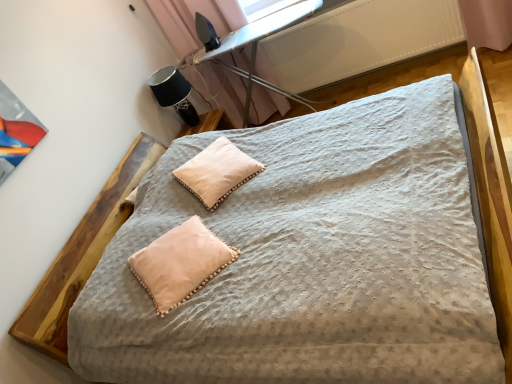
From the picture: What is the approximate width of white textured radiator at upper right?

white textured radiator at upper right is 5.88 inches wide.

In order to face white textured radiator at upper right, should I rotate leftwards or rightwards?

Rotate your view right by about 14.005°.

This screenshot has width=512, height=384. What do you see at coordinates (256, 48) in the screenshot? I see `metal ironing board at upper center` at bounding box center [256, 48].

Image resolution: width=512 pixels, height=384 pixels. Identify the location of black fabric table lamp at upper left. (174, 93).

Where is `white textured radiator at upper right`? Image resolution: width=512 pixels, height=384 pixels. white textured radiator at upper right is located at coordinates (360, 40).

Choose the correct answer: Is white textured radiator at upper right inside peach velvet pillow at lower left, which is the 2th pillow from top to bottom, or outside it?

white textured radiator at upper right lies outside peach velvet pillow at lower left, which is the 2th pillow from top to bottom.

Is point (319, 85) closer to camera compared to point (221, 264)?

No, it is not.

Does white textured radiator at upper right come in front of peach velvet pillow at lower left, marked as the first pillow in a front-to-back arrangement?

No, white textured radiator at upper right is further to the viewer.

Where is `table on the left of white textured radiator at upper right`? The width and height of the screenshot is (512, 384). table on the left of white textured radiator at upper right is located at coordinates (256, 48).

In the scene shown: Considering the sizes of metal ironing board at upper center and white textured radiator at upper right in the image, is metal ironing board at upper center bigger or smaller than white textured radiator at upper right?

metal ironing board at upper center is bigger than white textured radiator at upper right.

Considering the positions of objects metal ironing board at upper center and white textured radiator at upper right in the image provided, who is more to the right, metal ironing board at upper center or white textured radiator at upper right?

white textured radiator at upper right.

Can you see metal ironing board at upper center touching white textured radiator at upper right?

No, metal ironing board at upper center is not next to white textured radiator at upper right.

Is white textured radiator at upper right at the back of peach velvet pillow at lower left, the 2th pillow from the back?

peach velvet pillow at lower left, the 2th pillow from the back, does not have its back to white textured radiator at upper right.

Is peach velvet pillow at lower left, the 2th pillow from the back, completely or partially outside of white textured radiator at upper right?

Yes.

From a real-world perspective, between peach velvet pillow at lower left, which appears as the first pillow when ordered from the bottom, and white textured radiator at upper right, who is vertically lower?

white textured radiator at upper right, from a real-world perspective.

Is peach velvet pillow at lower left, marked as the first pillow in a front-to-back arrangement, to the left or to the right of white textured radiator at upper right in the image?

peach velvet pillow at lower left, marked as the first pillow in a front-to-back arrangement, is positioned on white textured radiator at upper right's left side.

Does peach velvet pillow at lower left, the 2th pillow from the back, contain white soft pillow at center, the second pillow positioned from the bottom?

No, white soft pillow at center, the second pillow positioned from the bottom, is not surrounded by peach velvet pillow at lower left, the 2th pillow from the back.

Can you confirm if peach velvet pillow at lower left, marked as the first pillow in a front-to-back arrangement, is smaller than white soft pillow at center, the second pillow positioned from the bottom?

Yes, peach velvet pillow at lower left, marked as the first pillow in a front-to-back arrangement, is smaller than white soft pillow at center, the second pillow positioned from the bottom.

Considering the relative positions of peach velvet pillow at lower left, the 2th pillow from the back, and white soft pillow at center, which is counted as the second pillow, starting from the front, in the image provided, is peach velvet pillow at lower left, the 2th pillow from the back, behind white soft pillow at center, which is counted as the second pillow, starting from the front,?

No, peach velvet pillow at lower left, the 2th pillow from the back, is in front of white soft pillow at center, which is counted as the second pillow, starting from the front.

Consider the image. Is the position of white textured radiator at upper right more distant than that of black fabric table lamp at upper left?

No.

Is black fabric table lamp at upper left at the back of white textured radiator at upper right?

white textured radiator at upper right does not have its back to black fabric table lamp at upper left.

Which of these two, white textured radiator at upper right or black fabric table lamp at upper left, is bigger?

Bigger between the two is white textured radiator at upper right.

Is metal ironing board at upper center located within black fabric table lamp at upper left?

No, metal ironing board at upper center is not surrounded by black fabric table lamp at upper left.

From the image's perspective, which is above, black fabric table lamp at upper left or metal ironing board at upper center?

From the image's view, metal ironing board at upper center is above.

Considering the relative sizes of black fabric table lamp at upper left and metal ironing board at upper center in the image provided, is black fabric table lamp at upper left wider than metal ironing board at upper center?

No, black fabric table lamp at upper left is not wider than metal ironing board at upper center.

Measure the distance from black fabric table lamp at upper left to metal ironing board at upper center.

The distance of black fabric table lamp at upper left from metal ironing board at upper center is 55.01 centimeters.

Which is less distant, (x=207, y=55) or (x=204, y=185)?

Point (x=204, y=185)

From a real-world perspective, who is located higher, metal ironing board at upper center or white soft pillow at center, placed as the 1th pillow when sorted from back to front?

In real-world perspective, white soft pillow at center, placed as the 1th pillow when sorted from back to front, is above.

Is metal ironing board at upper center shorter than white soft pillow at center, which is counted as the second pillow, starting from the front?

In fact, metal ironing board at upper center may be taller than white soft pillow at center, which is counted as the second pillow, starting from the front.

Are metal ironing board at upper center and white soft pillow at center, the 1th pillow from the top, far apart?

Yes, metal ironing board at upper center and white soft pillow at center, the 1th pillow from the top, are located far from each other.

I want to click on radiator located underneath the peach velvet pillow at lower left, which is the 2th pillow from top to bottom (from a real-world perspective), so click(x=360, y=40).

Find the location of a particular element. radiator behind the metal ironing board at upper center is located at coordinates (360, 40).

From the image, which object appears to be nearer to white soft pillow at center, which is counted as the second pillow, starting from the front, peach velvet pillow at lower left, which is the 2th pillow from top to bottom, or black fabric table lamp at upper left?

Among the two, peach velvet pillow at lower left, which is the 2th pillow from top to bottom, is located nearer to white soft pillow at center, which is counted as the second pillow, starting from the front.

Looking at the image, which one is located further to peach velvet pillow at lower left, marked as the first pillow in a front-to-back arrangement, white textured radiator at upper right or white soft pillow at center, the second pillow positioned from the bottom?

white textured radiator at upper right is further to peach velvet pillow at lower left, marked as the first pillow in a front-to-back arrangement.

Looking at the image, which one is located closer to black fabric table lamp at upper left, white textured radiator at upper right or peach velvet pillow at lower left, marked as the first pillow in a front-to-back arrangement?

Based on the image, white textured radiator at upper right appears to be nearer to black fabric table lamp at upper left.

From the image, which object appears to be farther from white textured radiator at upper right, metal ironing board at upper center or black fabric table lamp at upper left?

The object further to white textured radiator at upper right is black fabric table lamp at upper left.

When comparing their distances from peach velvet pillow at lower left, the 2th pillow from the back, does white textured radiator at upper right or black fabric table lamp at upper left seem further?

white textured radiator at upper right is further to peach velvet pillow at lower left, the 2th pillow from the back.

When comparing their distances from white textured radiator at upper right, does peach velvet pillow at lower left, which is the 2th pillow from top to bottom, or metal ironing board at upper center seem further?

peach velvet pillow at lower left, which is the 2th pillow from top to bottom.

Considering their positions, is white soft pillow at center, placed as the 1th pillow when sorted from back to front, positioned further to black fabric table lamp at upper left than peach velvet pillow at lower left, marked as the first pillow in a front-to-back arrangement?

peach velvet pillow at lower left, marked as the first pillow in a front-to-back arrangement.

Based on their spatial positions, is metal ironing board at upper center or peach velvet pillow at lower left, the 2th pillow from the back, closer to black fabric table lamp at upper left?

metal ironing board at upper center lies closer to black fabric table lamp at upper left than the other object.

You are a GUI agent. You are given a task and a screenshot of the screen. Output one action in this format:
    pyautogui.click(x=<x>, y=<y>)
    Task: Click on the table between white textured radiator at upper right and white soft pillow at center, the 1th pillow from the top, from top to bottom
    The image size is (512, 384).
    Given the screenshot: What is the action you would take?
    coord(256,48)

Find the location of `pillow between white textured radiator at upper right and peach velvet pillow at lower left, the 2th pillow from the back, in the up-down direction`. pillow between white textured radiator at upper right and peach velvet pillow at lower left, the 2th pillow from the back, in the up-down direction is located at coordinates (217, 172).

Where is `table lamp between white textured radiator at upper right and peach velvet pillow at lower left, the 2th pillow from the back, vertically`? table lamp between white textured radiator at upper right and peach velvet pillow at lower left, the 2th pillow from the back, vertically is located at coordinates (174, 93).

Where is `table between peach velvet pillow at lower left, the 2th pillow from the back, and black fabric table lamp at upper left, along the z-axis`? This screenshot has width=512, height=384. table between peach velvet pillow at lower left, the 2th pillow from the back, and black fabric table lamp at upper left, along the z-axis is located at coordinates (256, 48).